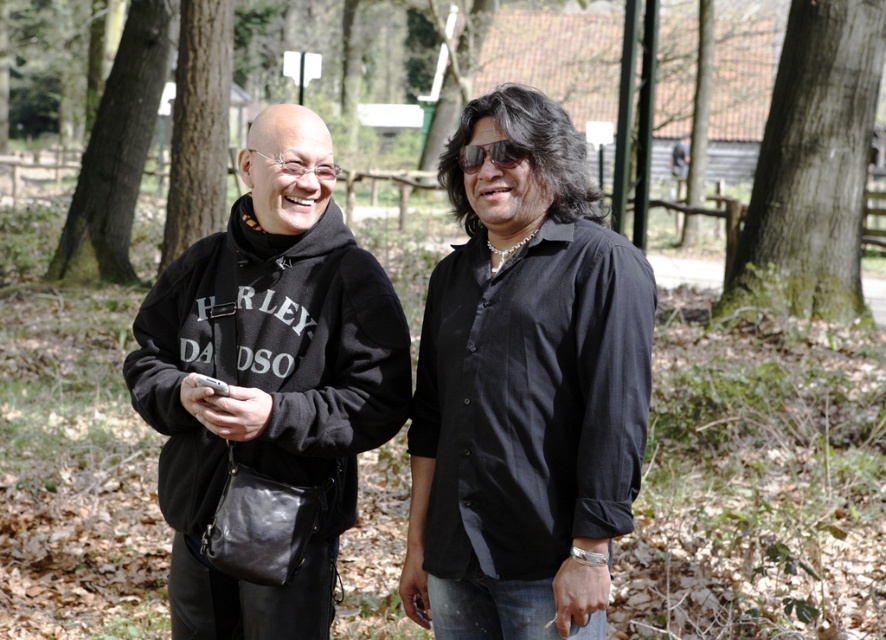
Question: Which point is farther to the camera?

Choices:
 (A) (737, 129)
 (B) (123, 163)
 (C) (612, 504)
 (D) (498, 147)

Answer: (A)

Question: Considering the real-world distances, which object is closest to the brown rough bark tree at left?

Choices:
 (A) brown bark tree at center
 (B) black satin shirt at center
 (C) black leather hoodie at left
 (D) green mossy bark tree at right

Answer: (D)

Question: From the image, what is the correct spatial relationship of black leather hoodie at left in relation to brown rough bark tree at left?

Choices:
 (A) left
 (B) right

Answer: (B)

Question: Does black satin shirt at center have a lesser width compared to black leather hoodie at left?

Choices:
 (A) no
 (B) yes

Answer: (B)

Question: Which of the following is the farthest from the observer?

Choices:
 (A) black satin shirt at center
 (B) green mossy bark tree at right

Answer: (B)

Question: Does brown bark tree at center lie in front of shiny black sunglasses at center?

Choices:
 (A) no
 (B) yes

Answer: (A)